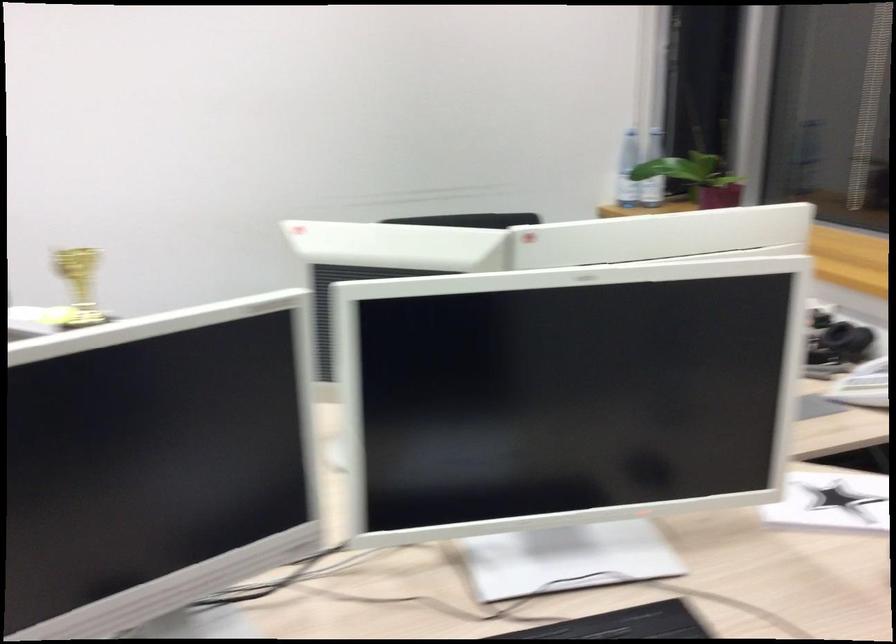
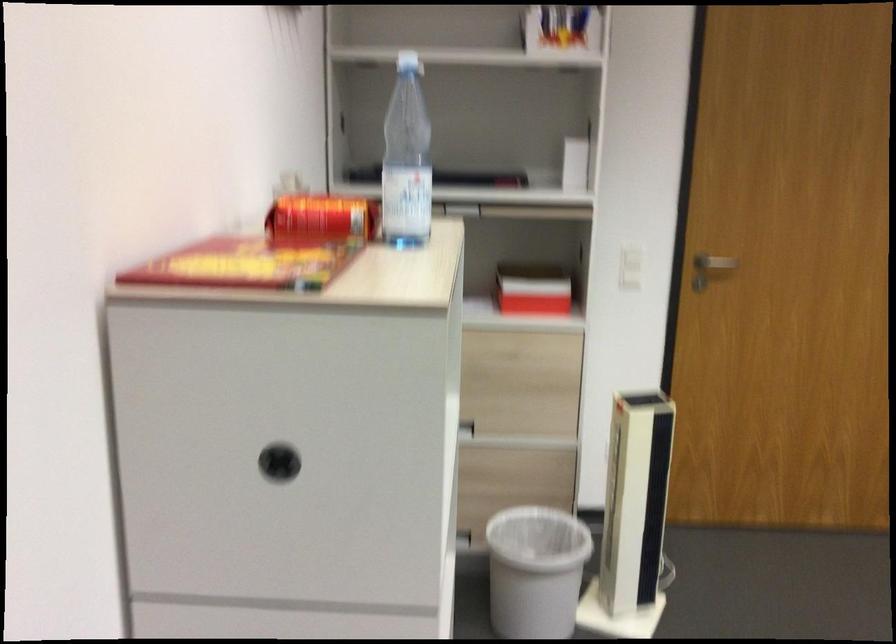
First-person continuous shooting, in which direction is the camera rotating?

The camera rotated toward left-down.